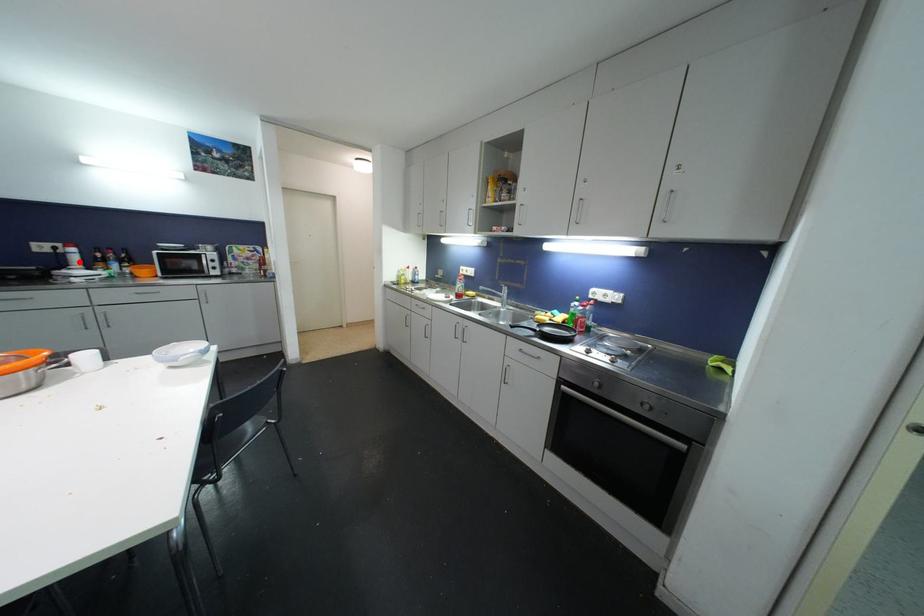
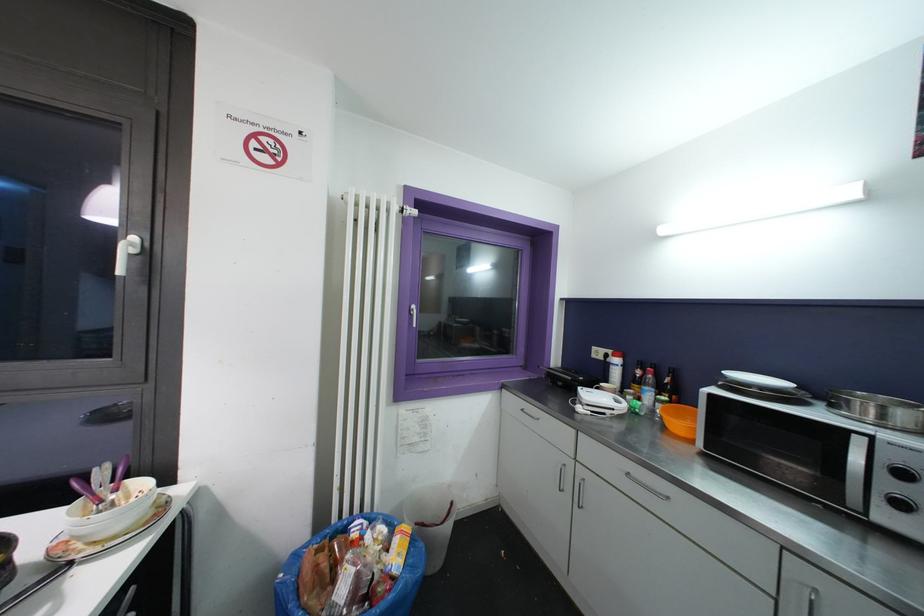
Find the pixel in the second image that matches the highlighted location in the first image.

(618, 376)